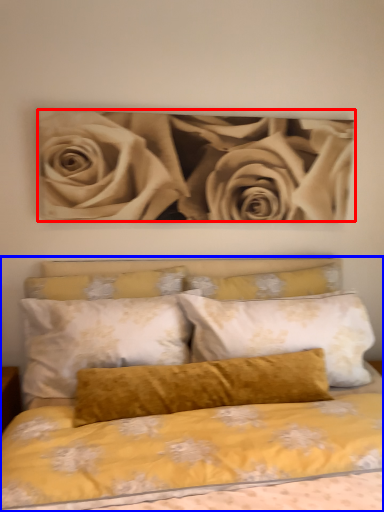
Question: Which object is closer to the camera taking this photo, rose (highlighted by a red box) or bed (highlighted by a blue box)?

Choices:
 (A) rose
 (B) bed

Answer: (B)